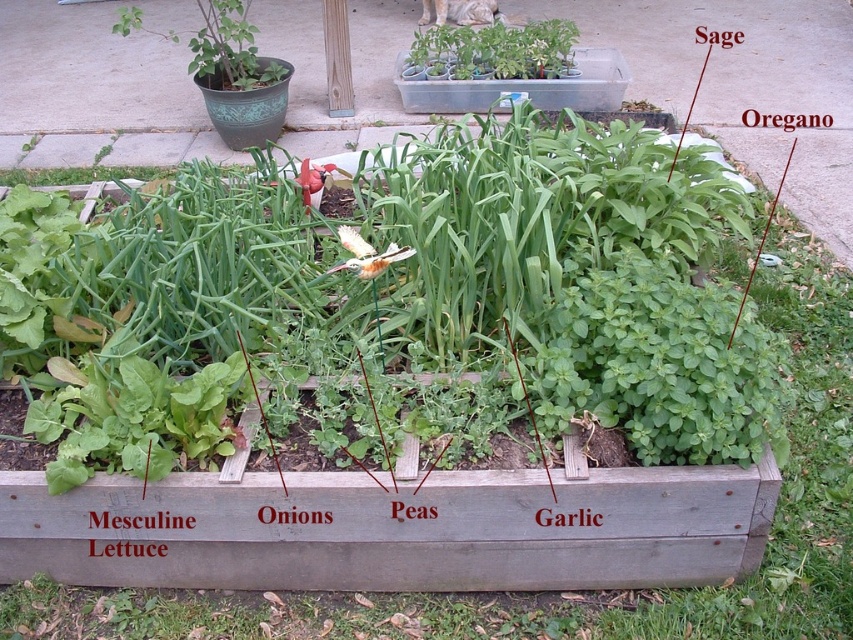
You are a gardener who wants to place a new plant in the garden bed. The new plant requires a space that is wider than the white matte flower at center. Can the clear plastic tray at upper center provide enough width for this new plant?

The clear plastic tray at upper center has a width larger than the white matte flower at center, so yes, the clear plastic tray at upper center can provide enough width for the new plant that requires a space wider than the white matte flower at center.

You are a gardener who wants to place a new plant in the garden bed. The new plant requires a spot that is not directly under the clear plastic tray at upper center. Based on the garden bed layout, where should you place the new plant?

The clear plastic tray at upper center is located at point (x=523, y=88). To avoid placing the new plant directly under it, choose a location outside of this coordinate, such as the left side near the Mesculine Lettuce or the center near the Peas.